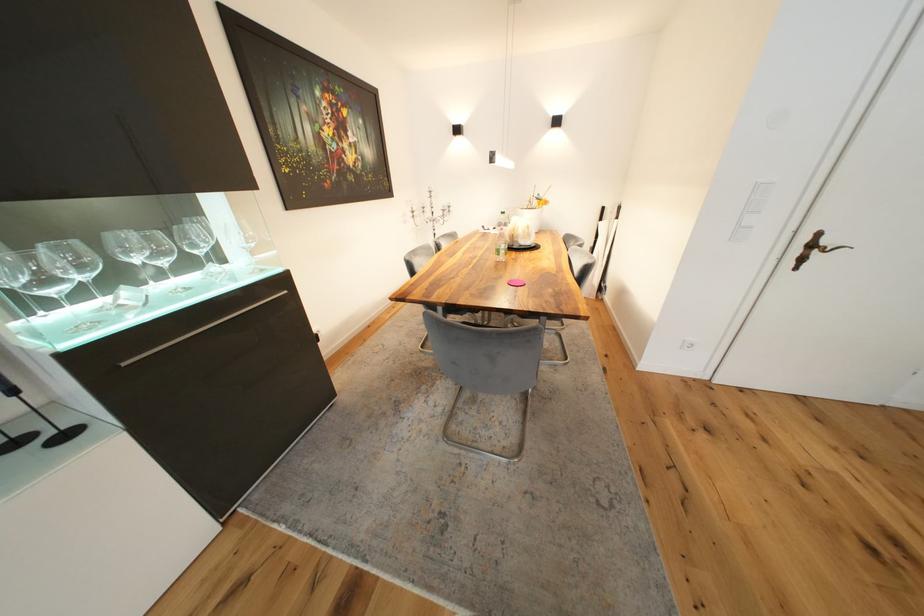
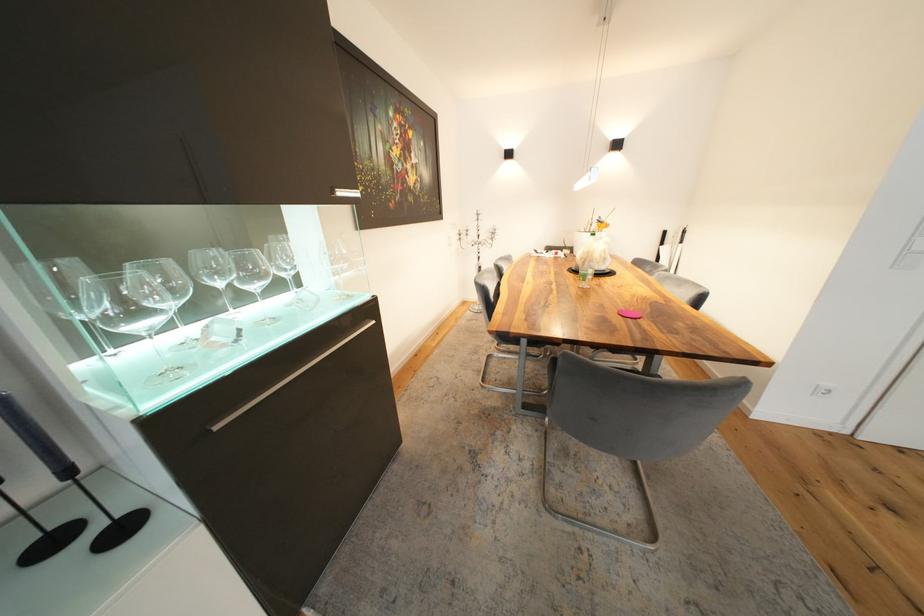
Where in the second image is the point corresponding to point (521, 232) from the first image?

(594, 254)